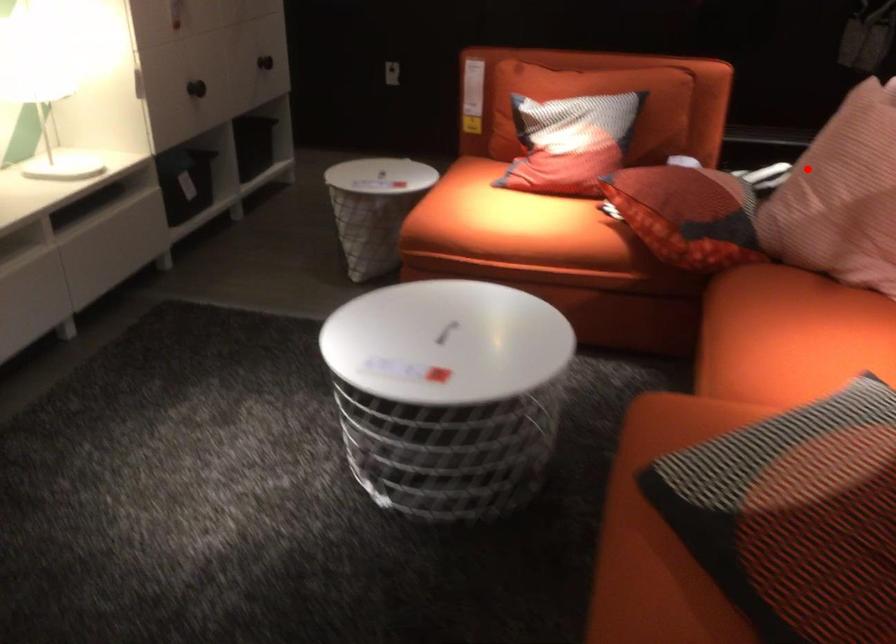
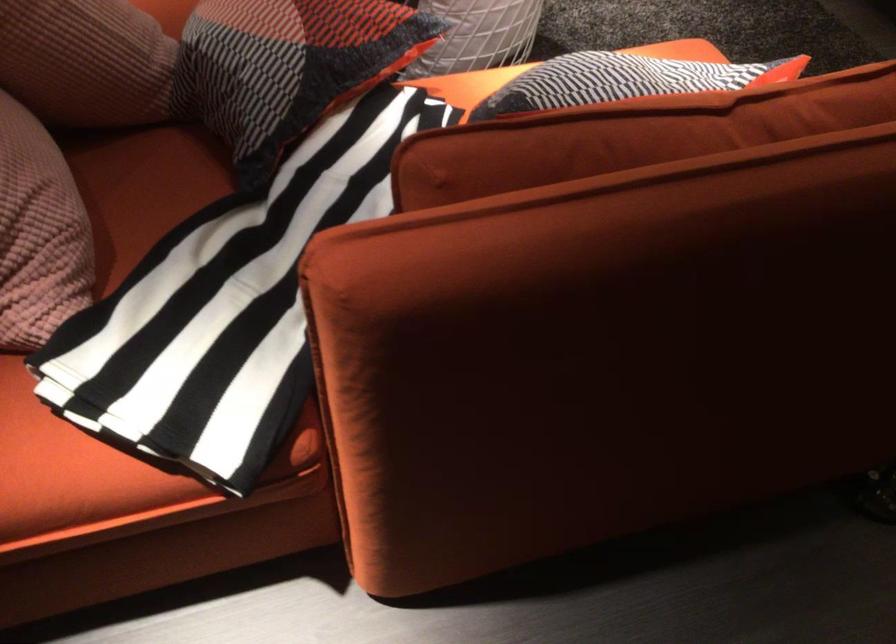
Locate, in the second image, the point that corresponds to the highlighted location in the first image.

(85, 61)